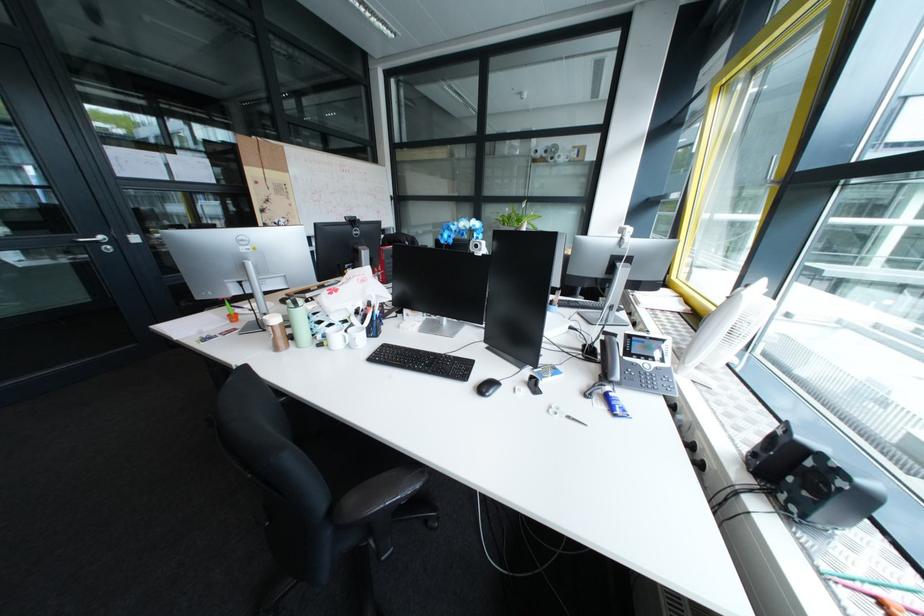
I want to click on phone handset, so coord(610,357).